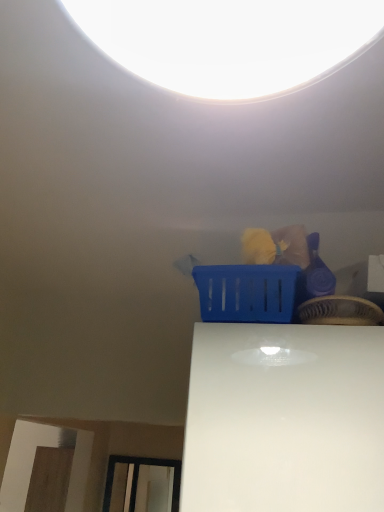
Where is `blue plastic basket at upper center, which is the second basket in right-to-left order`? The height and width of the screenshot is (512, 384). blue plastic basket at upper center, which is the second basket in right-to-left order is located at coordinates (247, 292).

What do you see at coordinates (247, 292) in the screenshot? The height and width of the screenshot is (512, 384). I see `blue plastic basket at upper center, which is the second basket in right-to-left order` at bounding box center [247, 292].

What is the approximate width of blue plastic basket at upper center, the 1th basket when ordered from left to right?

blue plastic basket at upper center, the 1th basket when ordered from left to right, is 13.32 inches in width.

You are a GUI agent. You are given a task and a screenshot of the screen. Output one action in this format:
    pyautogui.click(x=<x>, y=<y>)
    Task: Click on the blue plastic basket at upper center, acting as the first basket starting from the right
    The width and height of the screenshot is (384, 512).
    Given the screenshot: What is the action you would take?
    (340, 311)

What do you see at coordinates (340, 311) in the screenshot? The image size is (384, 512). I see `blue plastic basket at upper center, placed as the 2th basket when sorted from left to right` at bounding box center [340, 311].

The image size is (384, 512). I want to click on blue plastic basket at upper center, which is the second basket in right-to-left order, so click(x=247, y=292).

Between blue plastic basket at upper center, placed as the 2th basket when sorted from left to right, and blue plastic basket at upper center, the 1th basket when ordered from left to right, which one appears on the left side from the viewer's perspective?

From the viewer's perspective, blue plastic basket at upper center, the 1th basket when ordered from left to right, appears more on the left side.

From the picture: Does blue plastic basket at upper center, acting as the first basket starting from the right, lie in front of blue plastic basket at upper center, the 1th basket when ordered from left to right?

Yes.

Considering the positions of point (307, 311) and point (251, 303), is point (307, 311) closer or farther from the camera than point (251, 303)?

Clearly, point (307, 311) is closer to the camera than point (251, 303).

From the image's perspective, which object appears higher, blue plastic basket at upper center, placed as the 2th basket when sorted from left to right, or blue plastic basket at upper center, the 1th basket when ordered from left to right?

blue plastic basket at upper center, placed as the 2th basket when sorted from left to right.

From a real-world perspective, is blue plastic basket at upper center, placed as the 2th basket when sorted from left to right, located beneath blue plastic basket at upper center, which is the second basket in right-to-left order?

Correct, in the physical world, blue plastic basket at upper center, placed as the 2th basket when sorted from left to right, is lower than blue plastic basket at upper center, which is the second basket in right-to-left order.

Can you confirm if blue plastic basket at upper center, placed as the 2th basket when sorted from left to right, is wider than blue plastic basket at upper center, which is the second basket in right-to-left order?

No, blue plastic basket at upper center, placed as the 2th basket when sorted from left to right, is not wider than blue plastic basket at upper center, which is the second basket in right-to-left order.

Which of these two, blue plastic basket at upper center, acting as the first basket starting from the right, or blue plastic basket at upper center, which is the second basket in right-to-left order, stands taller?

Standing taller between the two is blue plastic basket at upper center, which is the second basket in right-to-left order.

Based on their sizes in the image, would you say blue plastic basket at upper center, acting as the first basket starting from the right, is bigger or smaller than blue plastic basket at upper center, the 1th basket when ordered from left to right?

Considering their sizes, blue plastic basket at upper center, acting as the first basket starting from the right, takes up less space than blue plastic basket at upper center, the 1th basket when ordered from left to right.

Is blue plastic basket at upper center, placed as the 2th basket when sorted from left to right, inside the boundaries of blue plastic basket at upper center, the 1th basket when ordered from left to right, or outside?

blue plastic basket at upper center, placed as the 2th basket when sorted from left to right, is outside blue plastic basket at upper center, the 1th basket when ordered from left to right.

In the scene shown: Does blue plastic basket at upper center, acting as the first basket starting from the right, touch blue plastic basket at upper center, the 1th basket when ordered from left to right?

Yes, blue plastic basket at upper center, acting as the first basket starting from the right, is beside blue plastic basket at upper center, the 1th basket when ordered from left to right.

Is blue plastic basket at upper center, acting as the first basket starting from the right, looking in the opposite direction of blue plastic basket at upper center, which is the second basket in right-to-left order?

That's not correct — blue plastic basket at upper center, acting as the first basket starting from the right, is not looking away from blue plastic basket at upper center, which is the second basket in right-to-left order.

Can you tell me how much blue plastic basket at upper center, placed as the 2th basket when sorted from left to right, and blue plastic basket at upper center, which is the second basket in right-to-left order, differ in facing direction?

The angle between the facing direction of blue plastic basket at upper center, placed as the 2th basket when sorted from left to right, and the facing direction of blue plastic basket at upper center, which is the second basket in right-to-left order, is 3.17 degrees.

Measure the distance between blue plastic basket at upper center, placed as the 2th basket when sorted from left to right, and blue plastic basket at upper center, which is the second basket in right-to-left order.

blue plastic basket at upper center, placed as the 2th basket when sorted from left to right, and blue plastic basket at upper center, which is the second basket in right-to-left order, are 3.62 inches apart from each other.

Identify the location of basket located on the right of blue plastic basket at upper center, the 1th basket when ordered from left to right. (340, 311).

Considering the relative positions of blue plastic basket at upper center, the 1th basket when ordered from left to right, and blue plastic basket at upper center, acting as the first basket starting from the right, in the image provided, is blue plastic basket at upper center, the 1th basket when ordered from left to right, to the left of blue plastic basket at upper center, acting as the first basket starting from the right, from the viewer's perspective?

Indeed, blue plastic basket at upper center, the 1th basket when ordered from left to right, is positioned on the left side of blue plastic basket at upper center, acting as the first basket starting from the right.

Which object is further away from the camera taking this photo, blue plastic basket at upper center, the 1th basket when ordered from left to right, or blue plastic basket at upper center, placed as the 2th basket when sorted from left to right?

blue plastic basket at upper center, the 1th basket when ordered from left to right, is further away from the camera.

Does point (290, 281) appear closer or farther from the camera than point (300, 314)?

Point (290, 281) appears to be farther away from the viewer than point (300, 314).

From the picture: From the image's perspective, which is above, blue plastic basket at upper center, the 1th basket when ordered from left to right, or blue plastic basket at upper center, placed as the 2th basket when sorted from left to right?

blue plastic basket at upper center, placed as the 2th basket when sorted from left to right.

From a real-world perspective, is blue plastic basket at upper center, the 1th basket when ordered from left to right, over blue plastic basket at upper center, acting as the first basket starting from the right?

Yes, from a real-world perspective, blue plastic basket at upper center, the 1th basket when ordered from left to right, is over blue plastic basket at upper center, acting as the first basket starting from the right

Is blue plastic basket at upper center, which is the second basket in right-to-left order, thinner than blue plastic basket at upper center, acting as the first basket starting from the right?

In fact, blue plastic basket at upper center, which is the second basket in right-to-left order, might be wider than blue plastic basket at upper center, acting as the first basket starting from the right.

Considering the sizes of objects blue plastic basket at upper center, the 1th basket when ordered from left to right, and blue plastic basket at upper center, placed as the 2th basket when sorted from left to right, in the image provided, who is shorter, blue plastic basket at upper center, the 1th basket when ordered from left to right, or blue plastic basket at upper center, placed as the 2th basket when sorted from left to right,?

blue plastic basket at upper center, placed as the 2th basket when sorted from left to right.

Looking at this image, is blue plastic basket at upper center, which is the second basket in right-to-left order, bigger than blue plastic basket at upper center, placed as the 2th basket when sorted from left to right?

Yes.

Is blue plastic basket at upper center, which is the second basket in right-to-left order, inside or outside of blue plastic basket at upper center, placed as the 2th basket when sorted from left to right?

blue plastic basket at upper center, which is the second basket in right-to-left order, is spatially situated outside blue plastic basket at upper center, placed as the 2th basket when sorted from left to right.

Is blue plastic basket at upper center, which is the second basket in right-to-left order, not near blue plastic basket at upper center, acting as the first basket starting from the right?

No, blue plastic basket at upper center, which is the second basket in right-to-left order, is not far away from blue plastic basket at upper center, acting as the first basket starting from the right.

Is blue plastic basket at upper center, which is the second basket in right-to-left order, aimed at blue plastic basket at upper center, acting as the first basket starting from the right?

No, blue plastic basket at upper center, which is the second basket in right-to-left order, is not oriented towards blue plastic basket at upper center, acting as the first basket starting from the right.

Consider the image. What's the angular difference between blue plastic basket at upper center, the 1th basket when ordered from left to right, and blue plastic basket at upper center, placed as the 2th basket when sorted from left to right,'s facing directions?

The angle between the facing direction of blue plastic basket at upper center, the 1th basket when ordered from left to right, and the facing direction of blue plastic basket at upper center, placed as the 2th basket when sorted from left to right, is 3.17 degrees.

How far apart are blue plastic basket at upper center, which is the second basket in right-to-left order, and blue plastic basket at upper center, placed as the 2th basket when sorted from left to right?

blue plastic basket at upper center, which is the second basket in right-to-left order, and blue plastic basket at upper center, placed as the 2th basket when sorted from left to right, are 3.62 inches apart.

Find the location of a particular element. basket located below the blue plastic basket at upper center, acting as the first basket starting from the right (from the image's perspective) is located at coordinates (247, 292).

You are a GUI agent. You are given a task and a screenshot of the screen. Output one action in this format:
    pyautogui.click(x=<x>, y=<y>)
    Task: Click on the basket below the blue plastic basket at upper center, which is the second basket in right-to-left order (from a real-world perspective)
    Image resolution: width=384 pixels, height=512 pixels.
    Given the screenshot: What is the action you would take?
    pyautogui.click(x=340, y=311)

Locate an element on the screen. Image resolution: width=384 pixels, height=512 pixels. basket lying behind the blue plastic basket at upper center, acting as the first basket starting from the right is located at coordinates (247, 292).